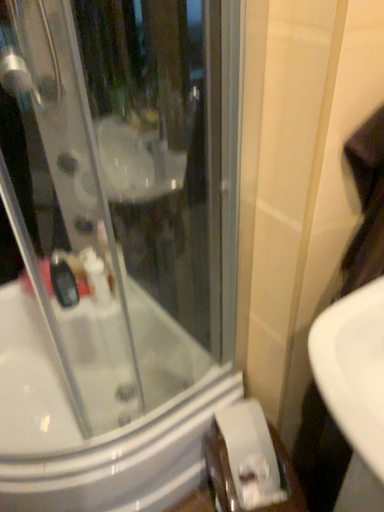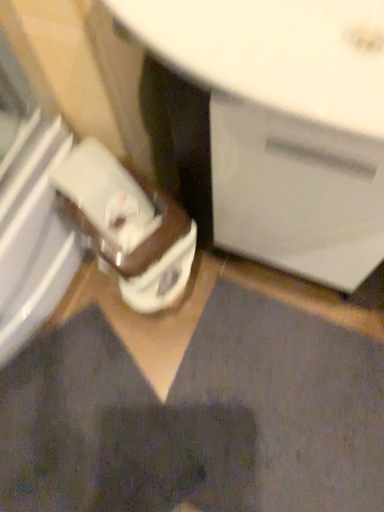
Question: How did the camera likely rotate when shooting the video?

Choices:
 (A) rotated upward
 (B) rotated downward

Answer: (B)